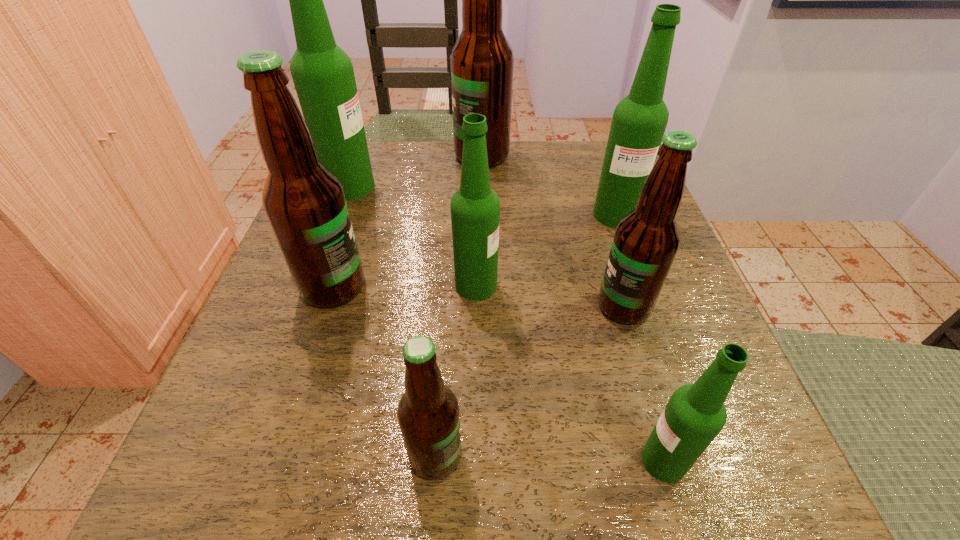
I want to click on the smallest brown beer bottle, so click(x=428, y=413).

The width and height of the screenshot is (960, 540). Identify the location of the smallest green beer bottle. tap(695, 414).

The image size is (960, 540). Identify the location of vacant space located on the label of the farthest beer bottle. (413, 156).

Find the location of `free region located 0.230m on the label of the farthest beer bottle`. free region located 0.230m on the label of the farthest beer bottle is located at coordinates (359, 156).

This screenshot has height=540, width=960. I want to click on free space located on the label of the farthest beer bottle, so [354, 156].

Where is `blank space located on the label of the seventh nearest beer bottle`? blank space located on the label of the seventh nearest beer bottle is located at coordinates 475,186.

Where is `vacant space positioned on the label of the second biggest brown beer bottle`? vacant space positioned on the label of the second biggest brown beer bottle is located at coordinates (413, 287).

I want to click on blank area located on the label of the third farthest object, so click(636, 275).

Where is `blank space located 0.360m on the label of the rightmost brown beer bottle`? This screenshot has width=960, height=540. blank space located 0.360m on the label of the rightmost brown beer bottle is located at coordinates (377, 306).

I want to click on free space located 0.200m on the label of the rightmost brown beer bottle, so click(475, 306).